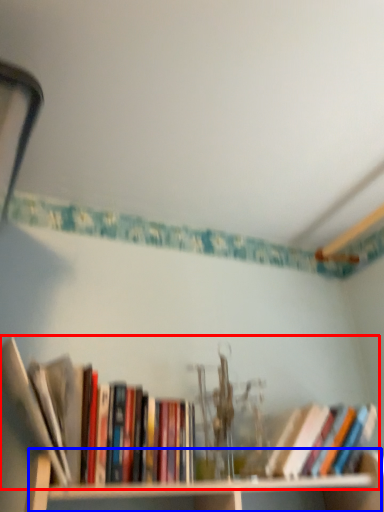
Question: Which of the following is the farthest to the observer, book (highlighted by a red box) or cabinet (highlighted by a blue box)?

Choices:
 (A) book
 (B) cabinet

Answer: (B)